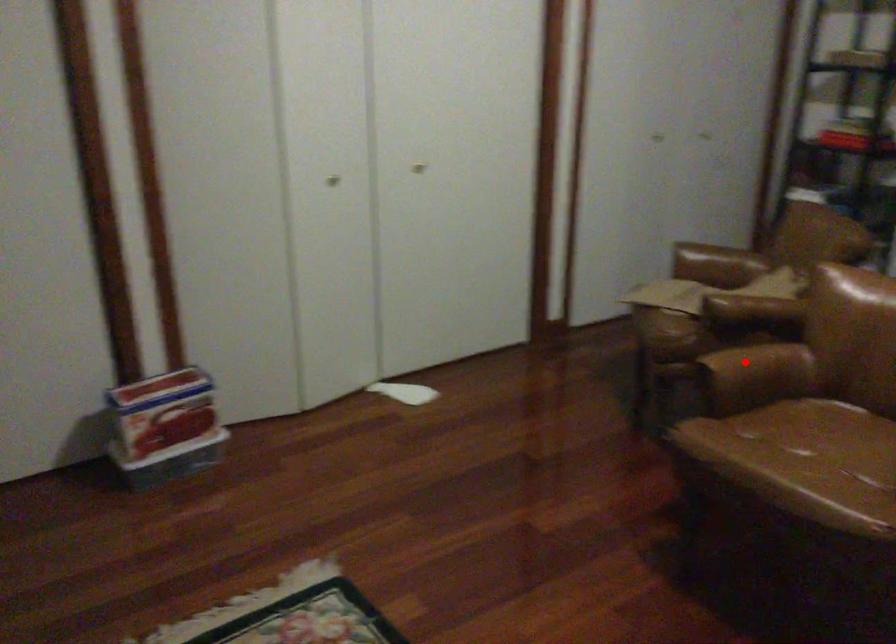
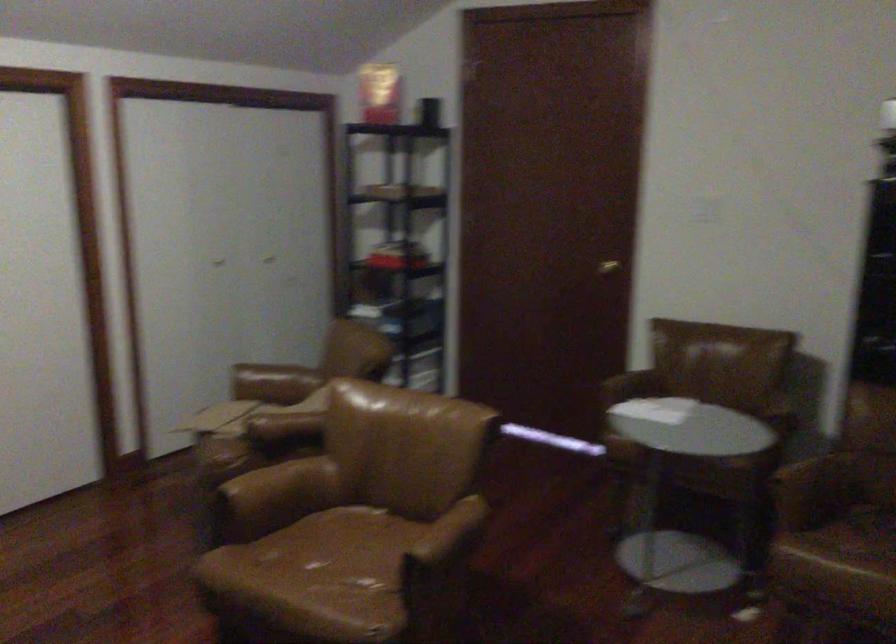
Where in the second image is the point corresponding to the highlighted location from the first image?

(280, 484)